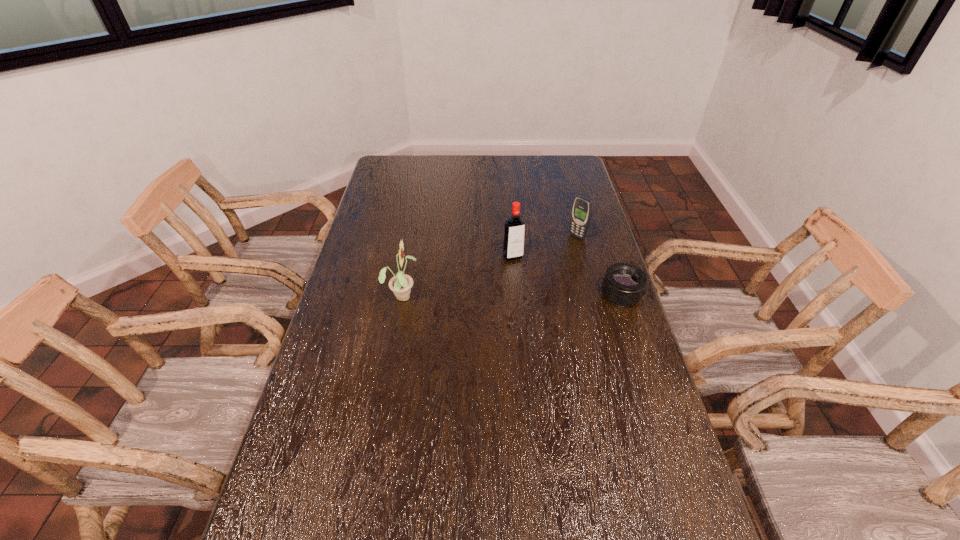
This screenshot has height=540, width=960. In order to click on free spot on the desktop that is between the sunflower and the telephoto lens and is positioned on the screen of the farthest object in this screenshot , I will do `click(499, 295)`.

At what (x,y) coordinates should I click in order to perform the action: click on free spot on the desktop that is between the leftmost object and the shortest object and is positioned on the front and back of the vodka. Please return your answer as a coordinate pair (x, y). The width and height of the screenshot is (960, 540). Looking at the image, I should click on (533, 295).